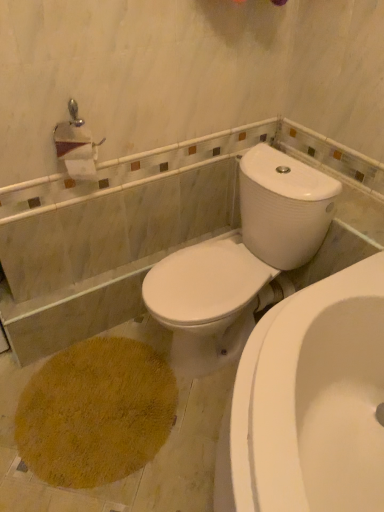
Question: From the image's perspective, is white glossy water tank at upper right located beneath white glossy toilet at center?

Choices:
 (A) yes
 (B) no

Answer: (B)

Question: From a real-world perspective, is white glossy water tank at upper right beneath white glossy toilet at center?

Choices:
 (A) no
 (B) yes

Answer: (A)

Question: Is white glossy water tank at upper right smaller than white glossy toilet at center?

Choices:
 (A) no
 (B) yes

Answer: (B)

Question: Can we say white glossy water tank at upper right lies outside white glossy toilet at center?

Choices:
 (A) yes
 (B) no

Answer: (A)

Question: Can white glossy toilet at center be found inside white glossy water tank at upper right?

Choices:
 (A) yes
 (B) no

Answer: (B)

Question: Is white glossy water tank at upper right positioned with its back to white glossy toilet at center?

Choices:
 (A) yes
 (B) no

Answer: (B)

Question: Are white glossy toilet at center and white glossy water tank at upper right making contact?

Choices:
 (A) no
 (B) yes

Answer: (B)

Question: Are white glossy toilet at center and white glossy water tank at upper right located far from each other?

Choices:
 (A) yes
 (B) no

Answer: (B)

Question: From the image's perspective, is white glossy toilet at center under white glossy water tank at upper right?

Choices:
 (A) yes
 (B) no

Answer: (A)

Question: Is white glossy toilet at center shorter than white glossy water tank at upper right?

Choices:
 (A) yes
 (B) no

Answer: (B)

Question: Is white glossy toilet at center bigger than white glossy water tank at upper right?

Choices:
 (A) yes
 (B) no

Answer: (A)

Question: Would you say white glossy toilet at center is outside white glossy water tank at upper right?

Choices:
 (A) no
 (B) yes

Answer: (B)

Question: Based on their positions, is white glossy water tank at upper right located to the left or right of white glossy toilet at center?

Choices:
 (A) left
 (B) right

Answer: (B)